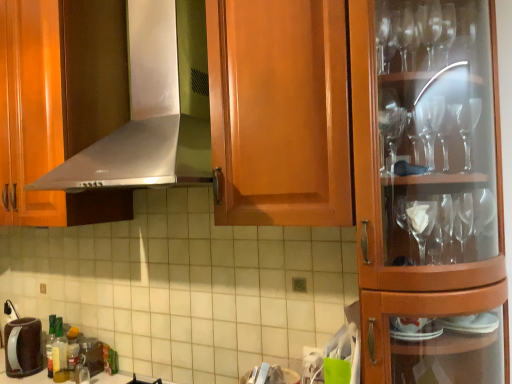
Measure the distance between point (93, 349) and camera.

Point (93, 349) is 5.83 feet away from camera.

You are a GUI agent. You are given a task and a screenshot of the screen. Output one action in this format:
    pyautogui.click(x=<x>, y=<y>)
    Task: Click on the brown matte coffee pot at lower left, which is counted as the 1th appliance, starting from the left
    The height and width of the screenshot is (384, 512).
    Given the screenshot: What is the action you would take?
    pyautogui.click(x=23, y=347)

At what (x,y) coordinates should I click in order to perform the action: click on satin silver exhaust hood at upper center. Please return your answer as a coordinate pair (x, y). This screenshot has height=384, width=512. Looking at the image, I should click on (153, 108).

Identify the location of metallic silver coffee maker at lower left, which is the second appliance in left-to-right order. The height and width of the screenshot is (384, 512). (91, 355).

Which point is more distant from viewer, (x=14, y=312) or (x=165, y=129)?

Positioned behind is point (x=14, y=312).

Which of these two, brushed metal faucet at lower left or satin silver exhaust hood at upper center, stands taller?

Standing taller between the two is satin silver exhaust hood at upper center.

Are brushed metal faucet at lower left and satin silver exhaust hood at upper center located far from each other?

Yes, brushed metal faucet at lower left and satin silver exhaust hood at upper center are located far from each other.

How many degrees apart are the facing directions of brushed metal faucet at lower left and satin silver exhaust hood at upper center?

0.683 degrees separate the facing orientations of brushed metal faucet at lower left and satin silver exhaust hood at upper center.

Considering the relative positions of brown matte coffee pot at lower left, positioned as the second appliance in right-to-left order, and brushed metal faucet at lower left in the image provided, is brown matte coffee pot at lower left, positioned as the second appliance in right-to-left order, in front of brushed metal faucet at lower left?

Yes, brown matte coffee pot at lower left, positioned as the second appliance in right-to-left order, is in front of brushed metal faucet at lower left.

Consider the image. From a real-world perspective, does brown matte coffee pot at lower left, which is counted as the 1th appliance, starting from the left, stand above brushed metal faucet at lower left?

No.

Between brown matte coffee pot at lower left, which is counted as the 1th appliance, starting from the left, and brushed metal faucet at lower left, which one has larger size?

brown matte coffee pot at lower left, which is counted as the 1th appliance, starting from the left.

Is brown matte coffee pot at lower left, positioned as the second appliance in right-to-left order, facing away from satin silver exhaust hood at upper center?

That's not correct — brown matte coffee pot at lower left, positioned as the second appliance in right-to-left order, is not looking away from satin silver exhaust hood at upper center.

Is satin silver exhaust hood at upper center completely or partially inside brown matte coffee pot at lower left, which is counted as the 1th appliance, starting from the left?

No.

Is point (14, 351) positioned behind point (140, 124)?

Yes, point (14, 351) is farther from viewer.

Is brown matte coffee pot at lower left, positioned as the second appliance in right-to-left order, in front of satin silver exhaust hood at upper center?

No.

From the image's perspective, which one is positioned higher, translucent plastic bottle at lower left or metallic silver coffee maker at lower left, which is the 1th appliance in right-to-left order?

translucent plastic bottle at lower left.

Is translucent plastic bottle at lower left positioned before metallic silver coffee maker at lower left, which is the second appliance in left-to-right order?

Yes, translucent plastic bottle at lower left is closer to the camera.

Is translucent plastic bottle at lower left smaller than metallic silver coffee maker at lower left, which is the second appliance in left-to-right order?

No.

Are translucent plastic bottle at lower left and metallic silver coffee maker at lower left, which is the 1th appliance in right-to-left order, making contact?

Yes, translucent plastic bottle at lower left is beside metallic silver coffee maker at lower left, which is the 1th appliance in right-to-left order.

Based on the photo, considering the sizes of objects brown matte coffee pot at lower left, positioned as the second appliance in right-to-left order, and metallic silver coffee maker at lower left, which is the 1th appliance in right-to-left order, in the image provided, who is wider, brown matte coffee pot at lower left, positioned as the second appliance in right-to-left order, or metallic silver coffee maker at lower left, which is the 1th appliance in right-to-left order,?

brown matte coffee pot at lower left, positioned as the second appliance in right-to-left order.

Find the location of a particular element. appliance above the metallic silver coffee maker at lower left, which is the second appliance in left-to-right order (from the image's perspective) is located at coordinates (23, 347).

Does brown matte coffee pot at lower left, which is counted as the 1th appliance, starting from the left, lie behind metallic silver coffee maker at lower left, which is the 1th appliance in right-to-left order?

No, it is in front of metallic silver coffee maker at lower left, which is the 1th appliance in right-to-left order.

From a real-world perspective, which is physically above, brown matte coffee pot at lower left, positioned as the second appliance in right-to-left order, or translucent plastic bottle at lower left?

translucent plastic bottle at lower left, from a real-world perspective.

Looking at this image, is brown matte coffee pot at lower left, positioned as the second appliance in right-to-left order, thinner than translucent plastic bottle at lower left?

In fact, brown matte coffee pot at lower left, positioned as the second appliance in right-to-left order, might be wider than translucent plastic bottle at lower left.

Does brown matte coffee pot at lower left, positioned as the second appliance in right-to-left order, appear on the right side of translucent plastic bottle at lower left?

No.

Is satin silver exhaust hood at upper center wider than brown matte coffee pot at lower left, which is counted as the 1th appliance, starting from the left?

Yes.

Are satin silver exhaust hood at upper center and brown matte coffee pot at lower left, positioned as the second appliance in right-to-left order, far apart?

satin silver exhaust hood at upper center is positioned a significant distance from brown matte coffee pot at lower left, positioned as the second appliance in right-to-left order.

Where is `exhaust hood above the brown matte coffee pot at lower left, which is counted as the 1th appliance, starting from the left (from the image's perspective)`? The width and height of the screenshot is (512, 384). exhaust hood above the brown matte coffee pot at lower left, which is counted as the 1th appliance, starting from the left (from the image's perspective) is located at coordinates (153, 108).

Could you measure the distance between satin silver exhaust hood at upper center and brown matte coffee pot at lower left, positioned as the second appliance in right-to-left order?

They are 1.07 meters apart.

Identify the location of exhaust hood in front of the brushed metal faucet at lower left. Image resolution: width=512 pixels, height=384 pixels. (153, 108).

The height and width of the screenshot is (384, 512). I want to click on faucet behind the brown matte coffee pot at lower left, which is counted as the 1th appliance, starting from the left, so click(x=10, y=311).

Which object lies further to the anchor point translucent plastic bottle at lower left, metallic silver coffee maker at lower left, which is the 1th appliance in right-to-left order, or satin silver exhaust hood at upper center?

satin silver exhaust hood at upper center.

When comparing their distances from brushed metal faucet at lower left, does brown matte coffee pot at lower left, positioned as the second appliance in right-to-left order, or satin silver exhaust hood at upper center seem closer?

brown matte coffee pot at lower left, positioned as the second appliance in right-to-left order, lies closer to brushed metal faucet at lower left than the other object.

Estimate the real-world distances between objects in this image. Which object is further from translucent plastic bottle at lower left, brushed metal faucet at lower left or satin silver exhaust hood at upper center?

The object further to translucent plastic bottle at lower left is satin silver exhaust hood at upper center.

Based on their spatial positions, is satin silver exhaust hood at upper center or brushed metal faucet at lower left closer to translucent plastic bottle at lower left?

Based on the image, brushed metal faucet at lower left appears to be nearer to translucent plastic bottle at lower left.

Estimate the real-world distances between objects in this image. Which object is further from brushed metal faucet at lower left, brown matte coffee pot at lower left, which is counted as the 1th appliance, starting from the left, or translucent plastic bottle at lower left?

translucent plastic bottle at lower left lies further to brushed metal faucet at lower left than the other object.

When comparing their distances from translucent plastic bottle at lower left, does metallic silver coffee maker at lower left, which is the 1th appliance in right-to-left order, or brushed metal faucet at lower left seem further?

brushed metal faucet at lower left is further to translucent plastic bottle at lower left.

When comparing their distances from brown matte coffee pot at lower left, which is counted as the 1th appliance, starting from the left, does brushed metal faucet at lower left or metallic silver coffee maker at lower left, which is the second appliance in left-to-right order, seem further?

metallic silver coffee maker at lower left, which is the second appliance in left-to-right order, lies further to brown matte coffee pot at lower left, which is counted as the 1th appliance, starting from the left, than the other object.

From the image, which object appears to be nearer to satin silver exhaust hood at upper center, translucent plastic bottle at lower left or brushed metal faucet at lower left?

Among the two, translucent plastic bottle at lower left is located nearer to satin silver exhaust hood at upper center.

You are a GUI agent. You are given a task and a screenshot of the screen. Output one action in this format:
    pyautogui.click(x=<x>, y=<y>)
    Task: Click on the appliance between satin silver exhaust hood at upper center and metallic silver coffee maker at lower left, which is the 1th appliance in right-to-left order, from top to bottom
    
    Given the screenshot: What is the action you would take?
    pyautogui.click(x=23, y=347)

Locate an element on the screen. This screenshot has height=384, width=512. faucet that lies between satin silver exhaust hood at upper center and brown matte coffee pot at lower left, which is counted as the 1th appliance, starting from the left, from top to bottom is located at coordinates [10, 311].

Image resolution: width=512 pixels, height=384 pixels. Find the location of `appliance situated between brushed metal faucet at lower left and metallic silver coffee maker at lower left, which is the 1th appliance in right-to-left order, from left to right`. appliance situated between brushed metal faucet at lower left and metallic silver coffee maker at lower left, which is the 1th appliance in right-to-left order, from left to right is located at coordinates pos(23,347).

Image resolution: width=512 pixels, height=384 pixels. I want to click on faucet between satin silver exhaust hood at upper center and metallic silver coffee maker at lower left, which is the 1th appliance in right-to-left order, in the up-down direction, so click(10, 311).